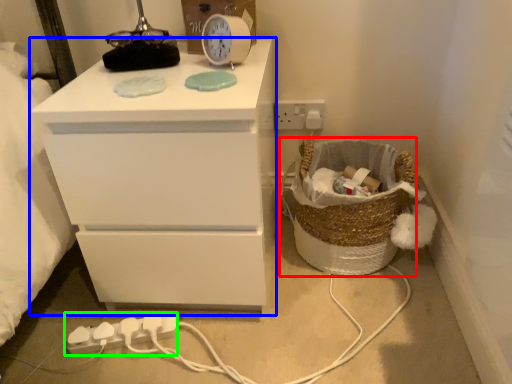
Question: Estimate the real-world distances between objects in this image. Which object is closer to basket (highlighted by a red box), chest of drawers (highlighted by a blue box) or extension cord (highlighted by a green box)?

Choices:
 (A) chest of drawers
 (B) extension cord

Answer: (A)